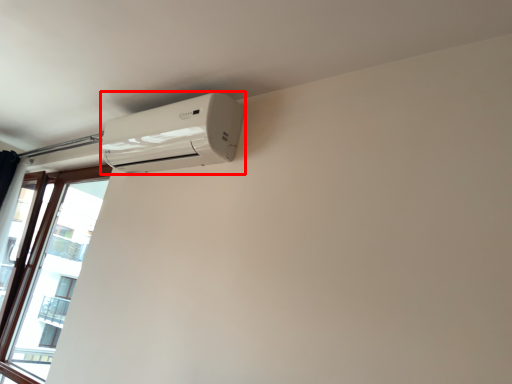
Question: From the image's perspective, what is the correct spatial relationship of home appliance (annotated by the red box) in relation to window?

Choices:
 (A) below
 (B) above

Answer: (B)